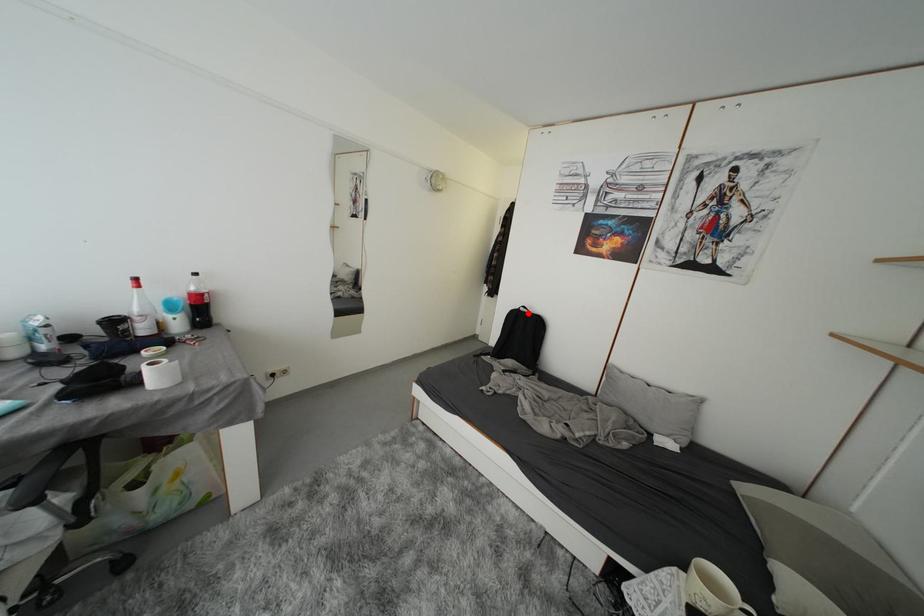
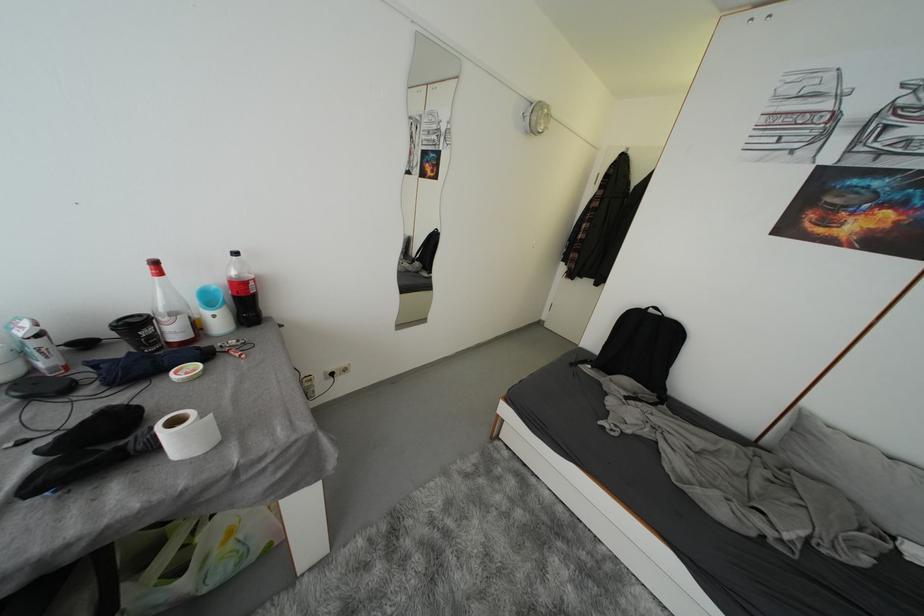
Where in the second image is the point corresponding to the highlighted location from the first image?

(658, 314)